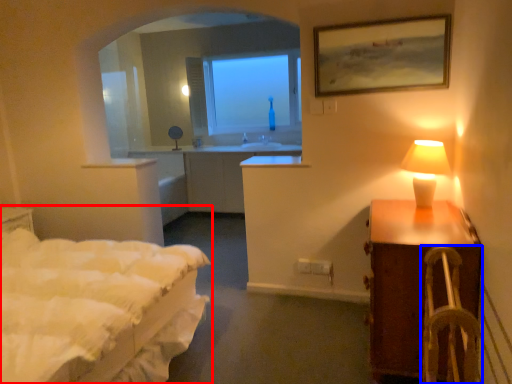
Question: Which object appears closest to the camera in this image, bed (highlighted by a red box) or armchair (highlighted by a blue box)?

Choices:
 (A) bed
 (B) armchair

Answer: (A)